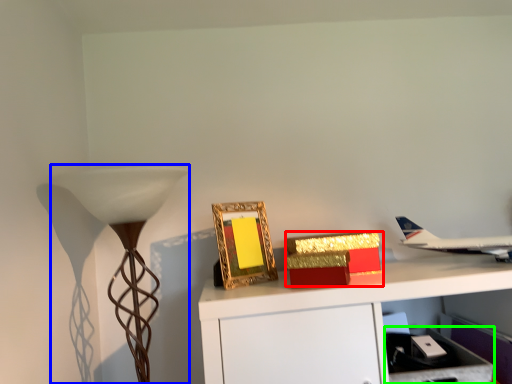
Question: Considering the real-world distances, which object is closest to box (highlighted by a red box)? lamp (highlighted by a blue box) or drawer (highlighted by a green box).

Choices:
 (A) lamp
 (B) drawer

Answer: (B)